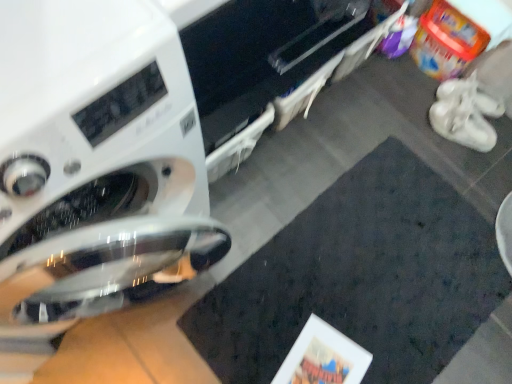
This screenshot has height=384, width=512. What are the coordinates of `vacant space that is to the left of white suede sneakers at right` in the screenshot? It's located at click(x=409, y=124).